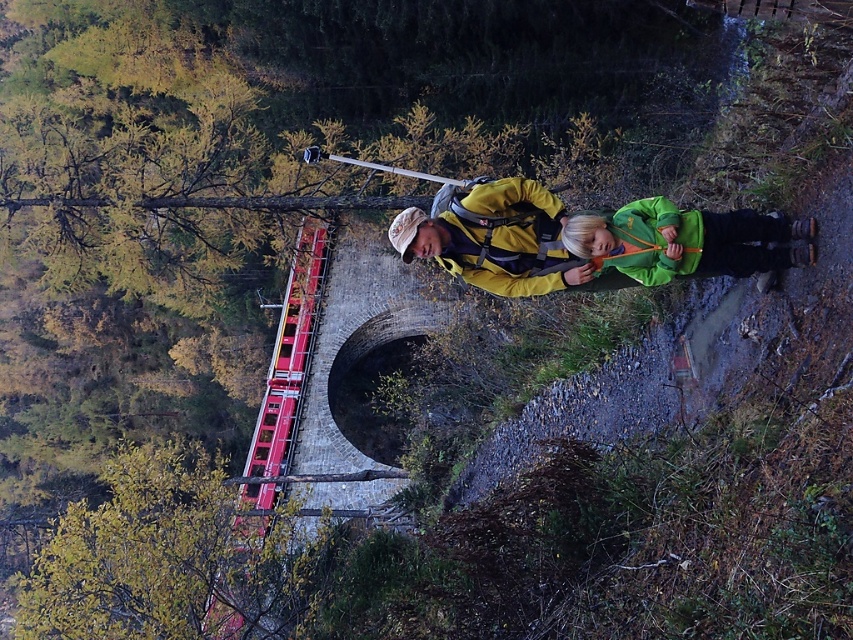
Question: Is green fleece jacket at center smaller than red plastic ladder at lower left?

Choices:
 (A) no
 (B) yes

Answer: (B)

Question: Which of the following is the farthest from the observer?

Choices:
 (A) green fleece jacket at center
 (B) yellow matte jacket at center
 (C) red plastic ladder at lower left

Answer: (C)

Question: Among these objects, which one is farthest from the camera?

Choices:
 (A) green fleece jacket at center
 (B) green fleece jacket at lower right
 (C) red plastic ladder at lower left

Answer: (C)

Question: Can you confirm if yellow matte jacket at center is positioned to the right of green fleece jacket at center?

Choices:
 (A) yes
 (B) no

Answer: (B)

Question: Is yellow matte jacket at center wider than red plastic ladder at lower left?

Choices:
 (A) yes
 (B) no

Answer: (B)

Question: Which object is closer to the camera taking this photo?

Choices:
 (A) green fleece jacket at center
 (B) yellow matte jacket at center
 (C) green fleece jacket at lower right
 (D) red plastic ladder at lower left

Answer: (A)